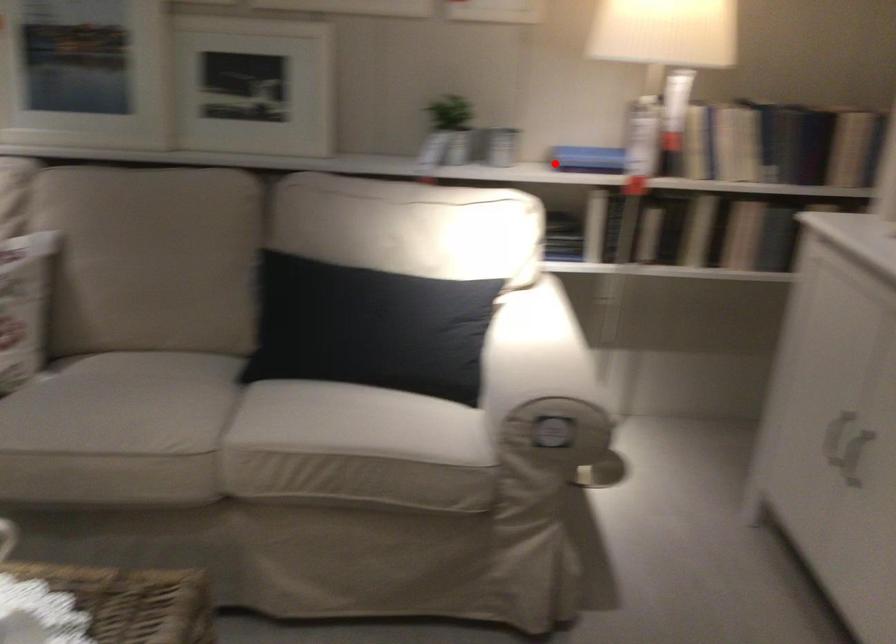
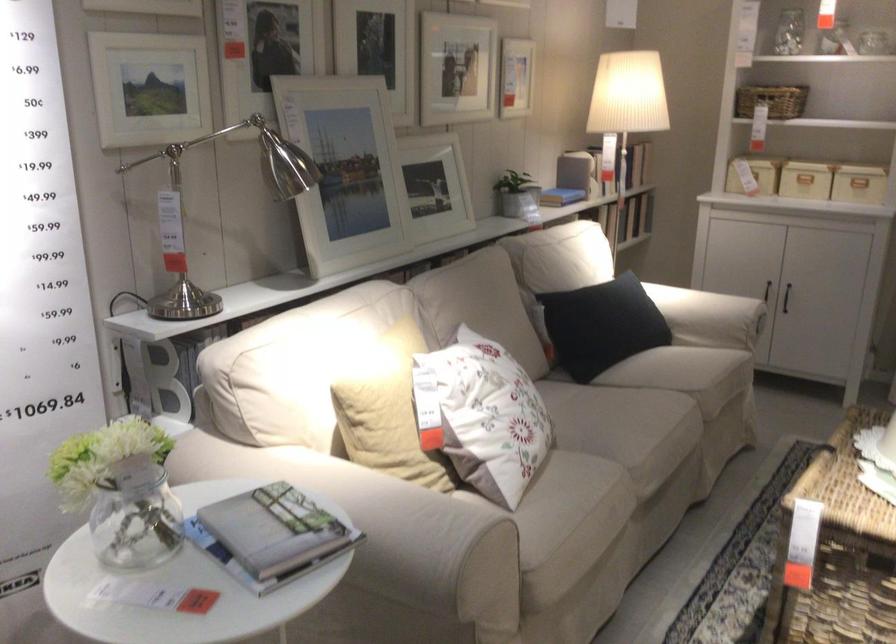
Question: I am providing you with two images of the same scene from different viewpoints. In image1, a red point is highlighted. Considering the same 3D point in image2, which of the following is correct?

Choices:
 (A) It is closer
 (B) It is farther

Answer: (B)